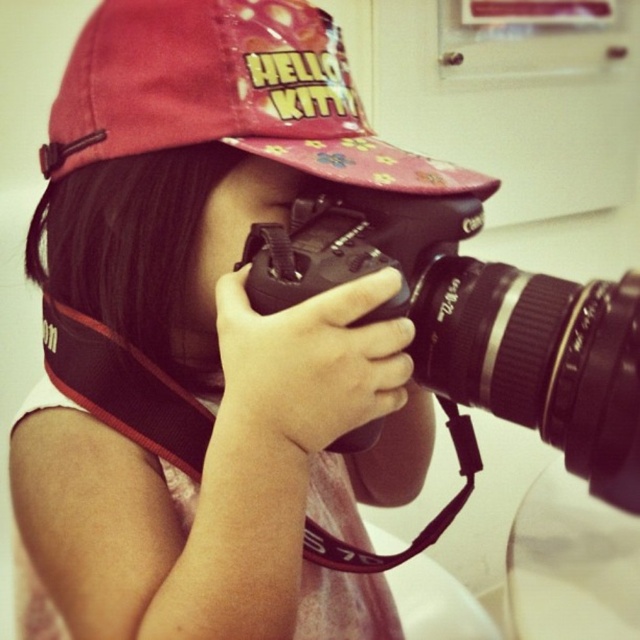
You are standing in a room and want to take a photo of the Canon DSLR camera. The camera is located at point (486, 365). You need to be at least 50 centimeters away from the camera to take a clear photo. Are you able to take a clear photo if you stand at your current position?

The distance between you and the camera is 46.92 centimeters, which is less than the required 50 centimeters. Therefore, you cannot take a clear photo from your current position.

You are a photographer trying to adjust the settings on your camera. You notice the black plastic camera at center and the pink fabric cap at upper center in your view. Which object is physically nearer to you for easier adjustment?

The black plastic camera at center is closer to the viewer than the pink fabric cap at upper center, so it is physically nearer and easier to adjust.

You are a photographer trying to decide whether to carry both the black plastic camera at center and the pink fabric cap at upper center in your bag. The bag has a compartment that can only hold items where the largest one fits. Which item should you prioritize packing first?

The black plastic camera at center is larger than the pink fabric cap at upper center, so you should prioritize packing the black plastic camera at center first to ensure it fits in the compartment.